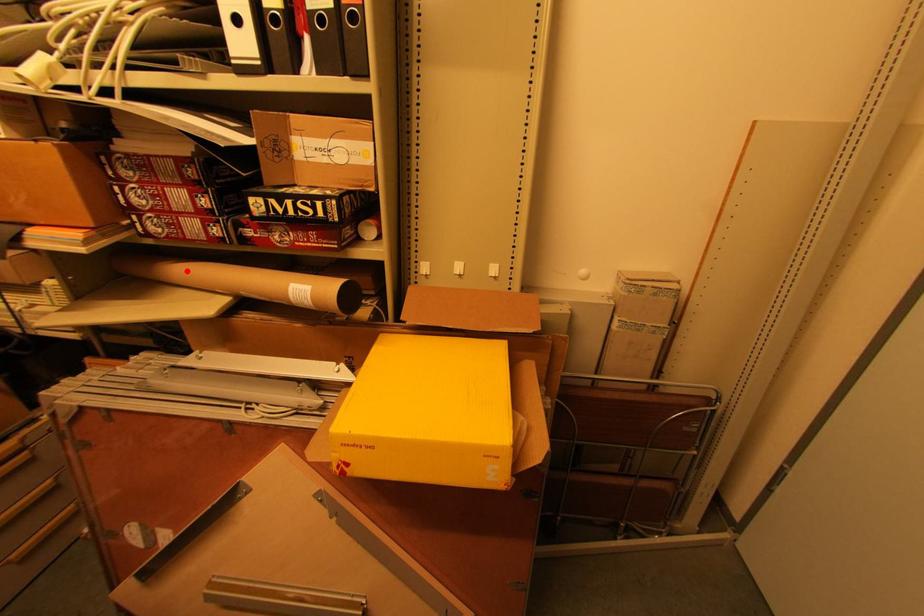
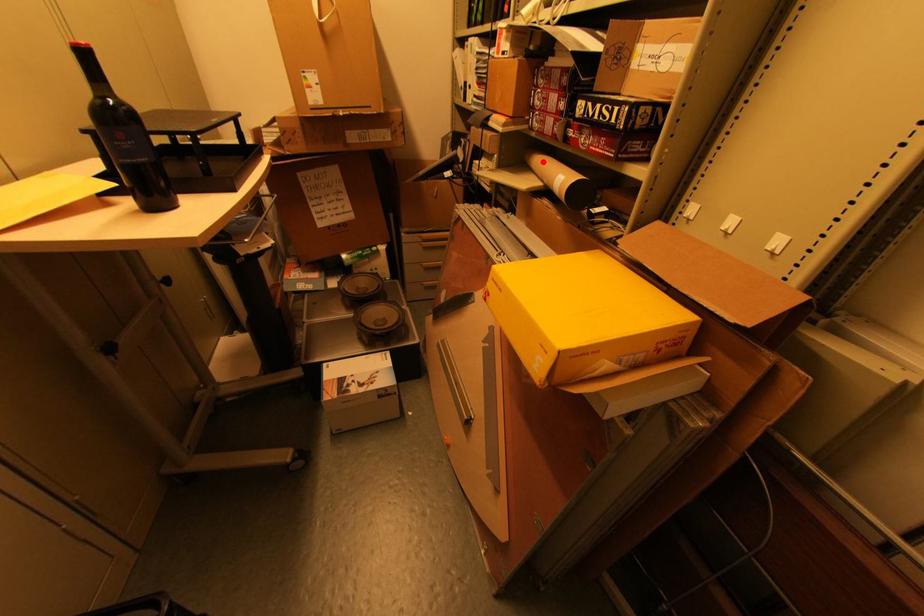
I am providing you with two images of the same scene from different viewpoints. A red point is marked on the first image and another point is marked on the second image. Is the red point in image1 aligned with the point shown in image2?

Yes